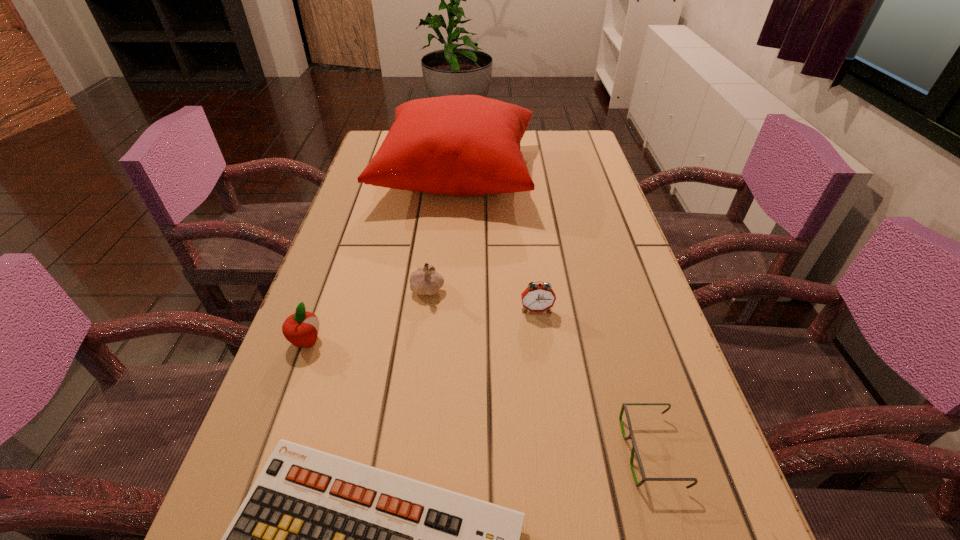
This screenshot has height=540, width=960. I want to click on the farthest object, so click(463, 145).

Locate an element on the screen. the tallest object is located at coordinates tap(463, 145).

This screenshot has height=540, width=960. Find the location of `garlic`. garlic is located at coordinates (424, 280).

You are a GUI agent. You are given a task and a screenshot of the screen. Output one action in this format:
    pyautogui.click(x=<x>, y=<y>)
    Task: Click on the alarm clock
    Image resolution: width=960 pixels, height=540 pixels.
    Given the screenshot: What is the action you would take?
    pyautogui.click(x=539, y=297)

In order to click on apple in this screenshot , I will do `click(301, 329)`.

Identify the location of the fifth tallest object. Image resolution: width=960 pixels, height=540 pixels. (634, 449).

Find the location of `the rightmost object`. the rightmost object is located at coordinates (634, 449).

You are a GUI agent. You are given a task and a screenshot of the screen. Output one action in this format:
    pyautogui.click(x=<x>, y=<y>)
    Task: Click on the vacant space located 0.380m on the front of the cushion
    The width and height of the screenshot is (960, 540).
    Given the screenshot: What is the action you would take?
    pyautogui.click(x=444, y=333)

You are a GUI agent. You are given a task and a screenshot of the screen. Output one action in this format:
    pyautogui.click(x=<x>, y=<y>)
    Task: Click on the vacant region located 0.330m on the back of the second farthest object
    
    Given the screenshot: What is the action you would take?
    pyautogui.click(x=439, y=197)

The image size is (960, 540). Identify the location of vacant point located 0.340m on the clock face of the fourth nearest object. (559, 481).